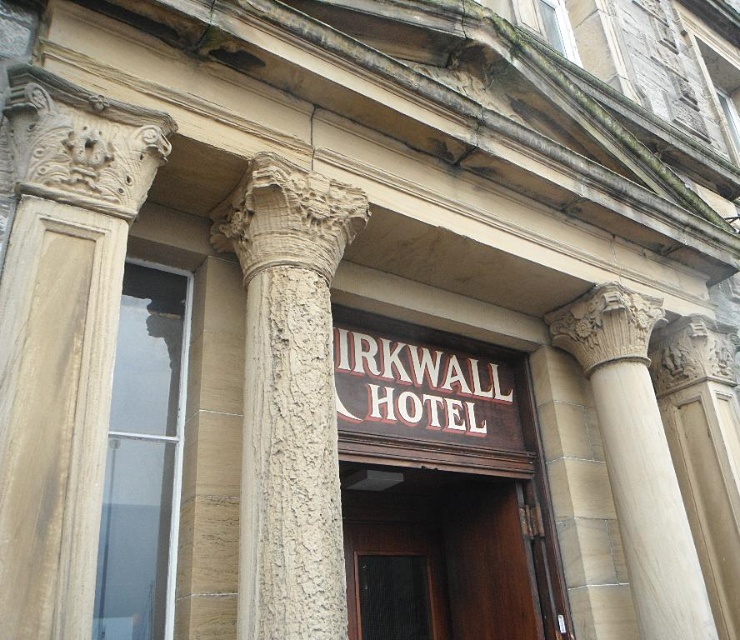
You are standing at the entrance of the Kirkwall Hotel and want to open the brown wooden door at center. To do so, you need to move aside the speckled stone column at center first. Is this possible based on their positions?

The speckled stone column at center is to the left of the brown wooden door at center, so you cannot move the column to open the door because it is already positioned to the side of the door and likely part of the building structure.

You are an architect assessing the entrance of the Kirkwall Hotel. You need to determine if the beige stone column at left can fit through a doorway that is the same width as the brown wooden sign at center. Can it pass through?

The beige stone column at left is narrower than the brown wooden sign at center, so it can pass through the doorway designed to match the sign.

You are standing at the entrance of the Kirkwall Hotel and want to take a photo of the speckled stone column at center. If you are positioned at the center of the entrance, which direction should you move to get a better view of the column?

Since the speckled stone column at center is located at coordinates point (x=289, y=396), you should move to the right to align yourself with the column for a better view.